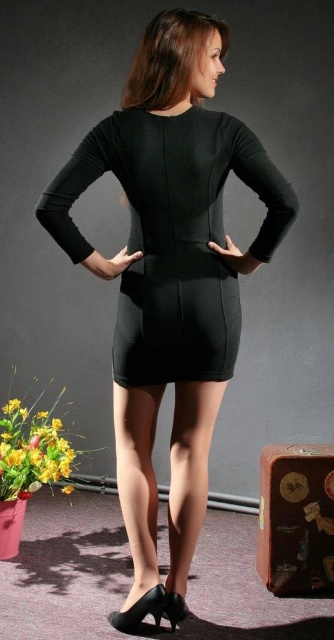
You are a photographer setting up a shoot in the described scene. You need to place a small accent light at point (x=173, y=236). What object will be directly under this light?

The black matte dress at center is located at point (x=173, y=236), so the light will shine directly on it.

You are a fashion designer analyzing the image of a person wearing a black dress and high heels. You notice a point at coordinates (137, 481). What item does this point correspond to?

The point at coordinates (137, 481) corresponds to the satin smooth stockings at lower center.

From the picture: You are a fashion designer trying to create a new outfit. You have the black matte dress at center and the satin smooth stockings at lower center. Which item has a greater width?

The black matte dress at center has a greater width than the satin smooth stockings at lower center.